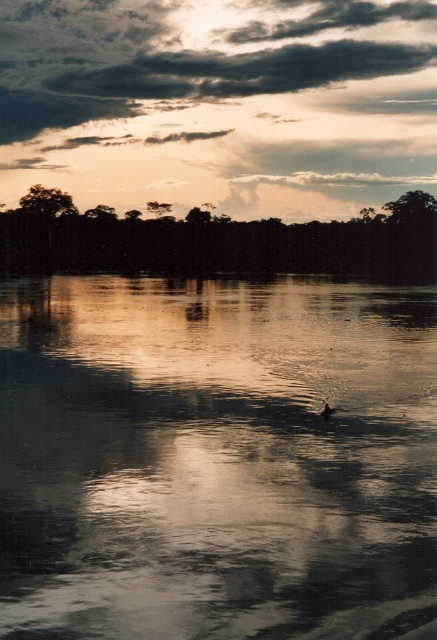
Question: Is silvery reflective water at center positioned before green leafy tree at upper left?

Choices:
 (A) yes
 (B) no

Answer: (A)

Question: Which point appears farthest from the camera in this image?

Choices:
 (A) (54, 205)
 (B) (243, 262)
 (C) (156, 208)
 (D) (319, 413)

Answer: (C)

Question: Which of the following is the farthest from the observer?

Choices:
 (A) coord(278,145)
 (B) coord(330,410)

Answer: (A)

Question: From the image, what is the correct spatial relationship of silvery reflective water at center in relation to dark green leafy trees at upper center?

Choices:
 (A) above
 (B) below

Answer: (B)

Question: Among these points, which one is farthest from the camera?

Choices:
 (A) (92, 250)
 (B) (325, 410)
 (C) (42, 205)

Answer: (C)

Question: Does cloudy sky at upper center appear under dark green leafy trees at upper center?

Choices:
 (A) no
 (B) yes

Answer: (A)